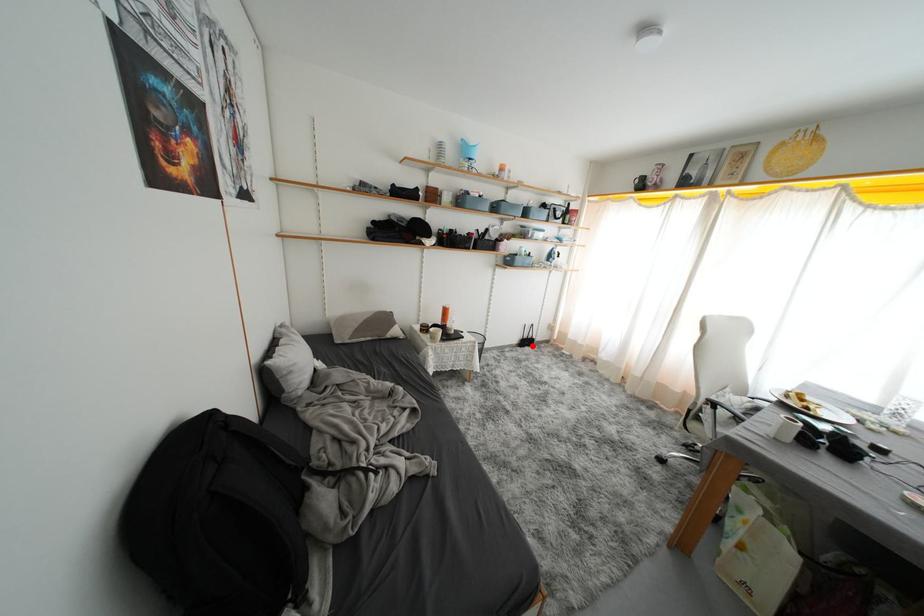
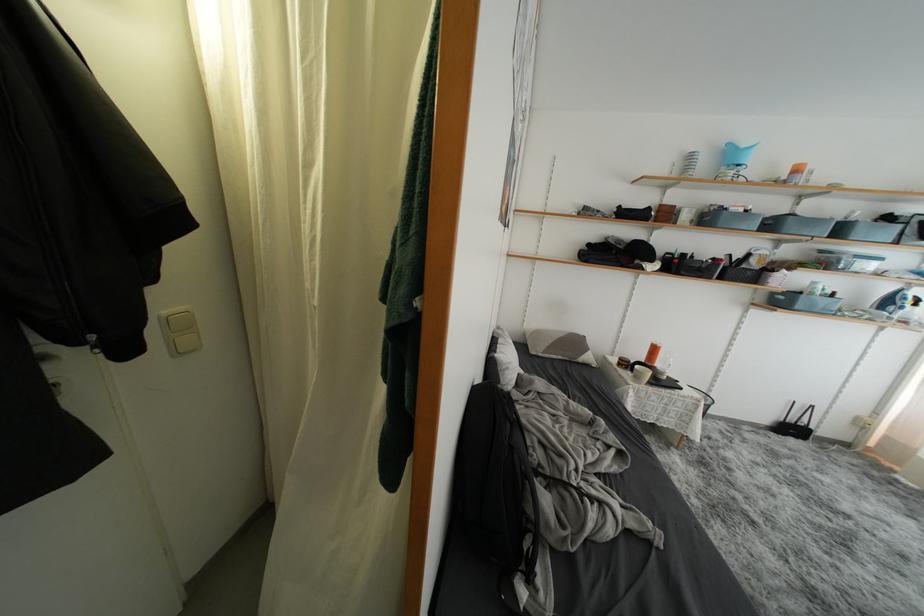
Question: I am providing you with two images of the same scene from different viewpoints. Given a red point in image1, look at the same physical point in image2. Is it:

Choices:
 (A) Closer to the viewpoint
 (B) Farther from the viewpoint

Answer: (A)